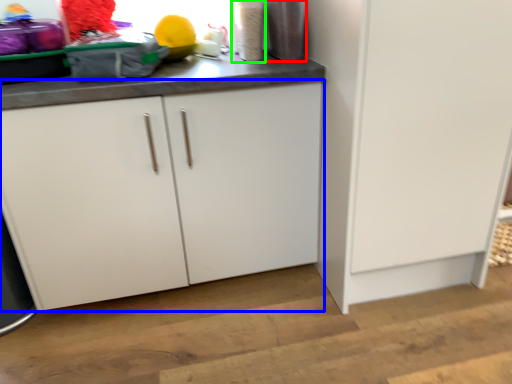
Question: Which object is positioned farthest from appliance (highlighted by a red box)? Select from cabinetry (highlighted by a blue box) and appliance (highlighted by a green box).

Choices:
 (A) cabinetry
 (B) appliance

Answer: (A)